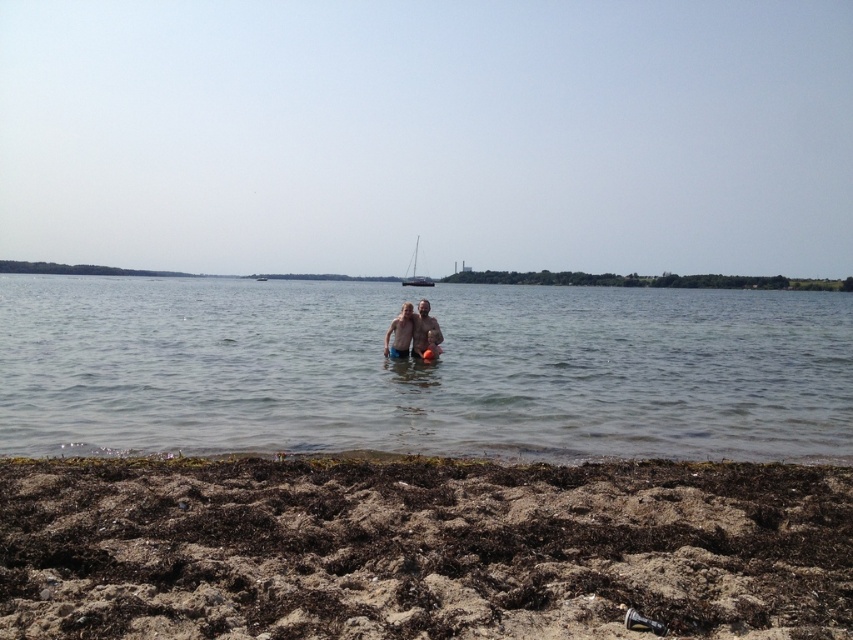
Question: Which object is farther from the camera taking this photo?

Choices:
 (A) clear water at center
 (B) smooth skin couple at center

Answer: (B)

Question: Is brown sandy beach at lower center below smooth skin couple at center?

Choices:
 (A) no
 (B) yes

Answer: (B)

Question: Which of the following is the farthest from the observer?

Choices:
 (A) (167, 348)
 (B) (438, 330)
 (C) (428, 339)

Answer: (A)

Question: Is clear water at center closer to the viewer compared to white matte sailboat at center?

Choices:
 (A) no
 (B) yes

Answer: (B)

Question: Among these objects, which one is farthest from the camera?

Choices:
 (A) white matte sailboat at center
 (B) smooth skin couple at center
 (C) clear water at center

Answer: (A)

Question: Is brown sandy beach at lower center below white matte sailboat at center?

Choices:
 (A) yes
 (B) no

Answer: (A)